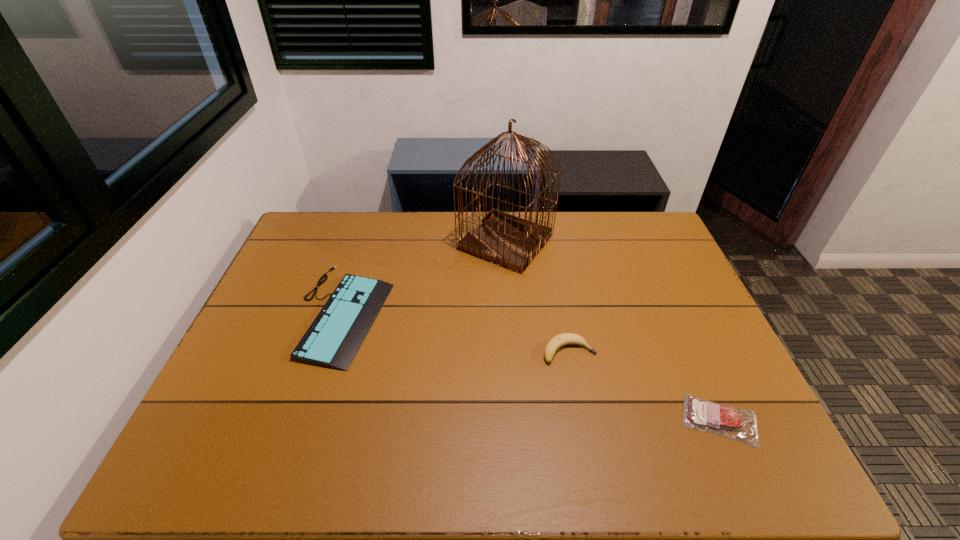
Find the location of a particular element. object identified as the second closest to the computer keyboard is located at coordinates (555, 343).

Locate an element on the screen. The width and height of the screenshot is (960, 540). object that is the third closest to the nearest object is located at coordinates (333, 339).

Locate an element on the screen. Image resolution: width=960 pixels, height=540 pixels. vacant area that satisfies the following two spatial constraints: 1. on the front side of the banana; 2. on the left side of the third tallest object is located at coordinates (331, 352).

Where is `free location that satisfies the following two spatial constraints: 1. on the front side of the nearest object; 2. on the left side of the second shortest object`? The height and width of the screenshot is (540, 960). free location that satisfies the following two spatial constraints: 1. on the front side of the nearest object; 2. on the left side of the second shortest object is located at coordinates (309, 420).

At what (x,y) coordinates should I click in order to perform the action: click on vacant space that satisfies the following two spatial constraints: 1. on the front side of the computer keyboard; 2. on the left side of the shortest object. Please return your answer as a coordinate pair (x, y). The image size is (960, 540). Looking at the image, I should click on click(309, 420).